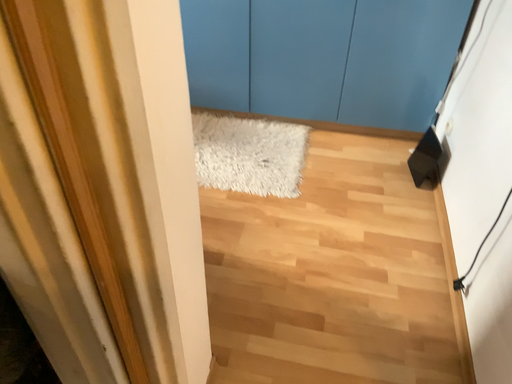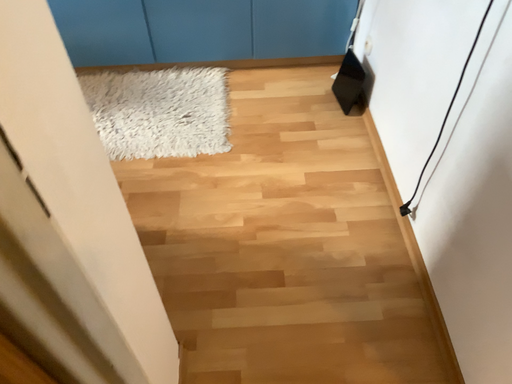
Question: How did the camera likely rotate when shooting the video?

Choices:
 (A) rotated downward
 (B) rotated upward

Answer: (A)